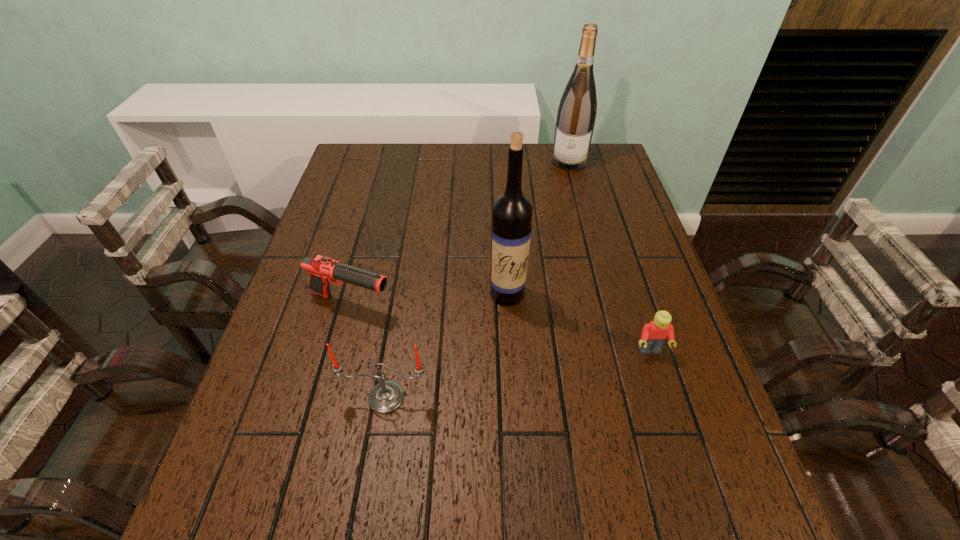
Find the location of a particular element. Image resolution: width=960 pixels, height=540 pixels. vacant space on the desktop that is between the nearest object and the second nearest object and is positioned on the label of the nearer wine bottle is located at coordinates (515, 375).

Locate an element on the screen. The image size is (960, 540). free spot on the desktop that is between the nearest object and the second nearest object and is positioned on the label of the farther wine bottle is located at coordinates (532, 372).

Where is `free spot on the desktop that is between the nearest object and the fourth farthest object and is positioned at the aiming end of the gun`? free spot on the desktop that is between the nearest object and the fourth farthest object and is positioned at the aiming end of the gun is located at coordinates (549, 369).